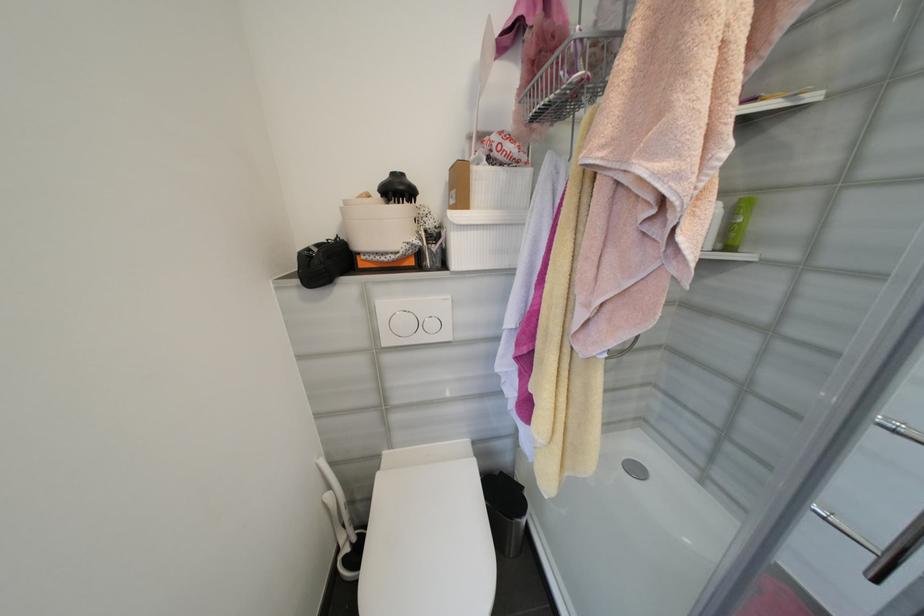
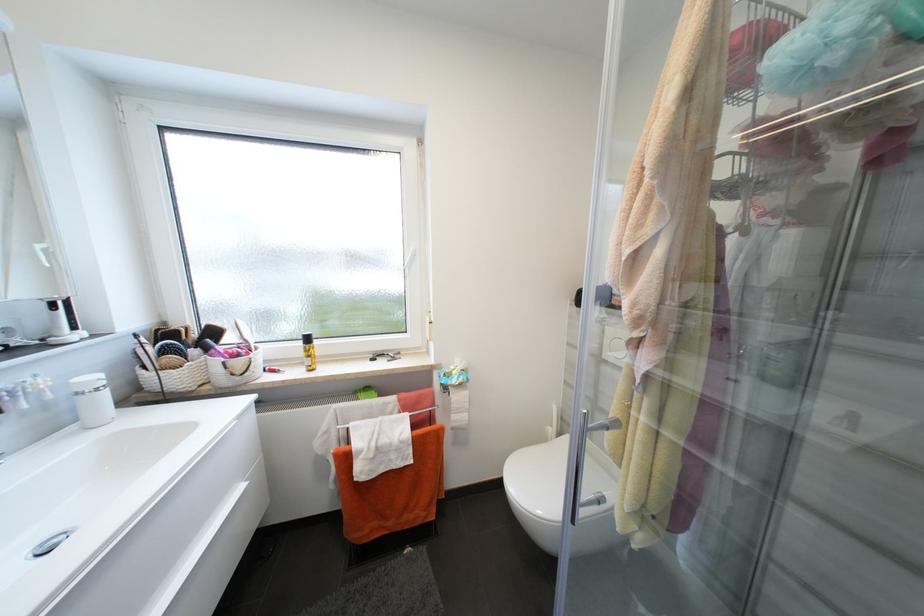
Question: The images are taken continuously from a first-person perspective. In which direction is your viewpoint rotating?

Choices:
 (A) Left
 (B) Right
 (C) Up
 (D) Down

Answer: (A)